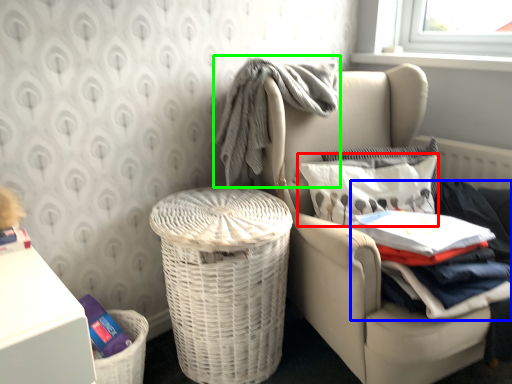
Question: Which is nearer to the pillow (highlighted by a red box)? clothing (highlighted by a blue box) or baby clothe (highlighted by a green box).

Choices:
 (A) clothing
 (B) baby clothe

Answer: (A)